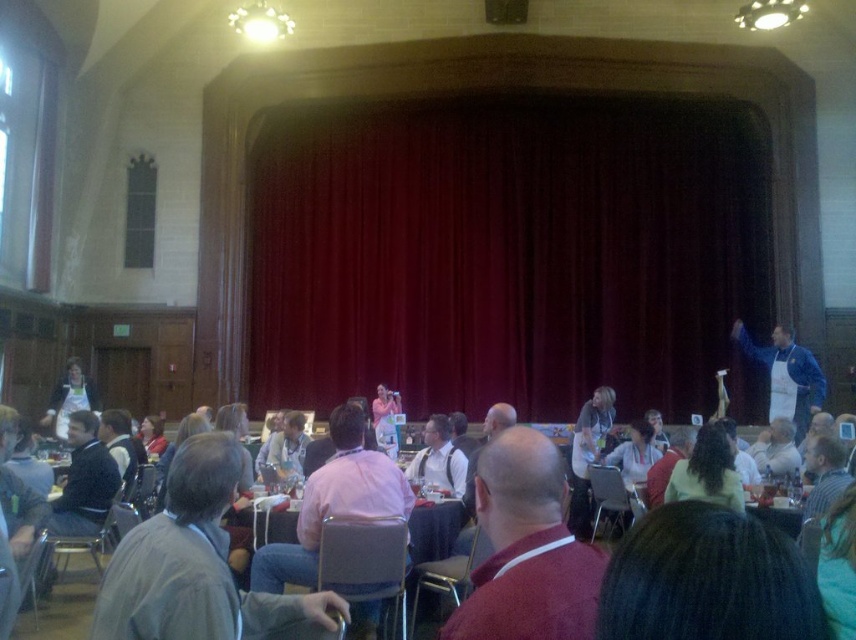
Does red velvet curtain at center have a lesser width compared to curly hair at center?

Incorrect, red velvet curtain at center's width is not less than curly hair at center's.

In the scene shown: Who is taller, red velvet curtain at center or curly hair at center?

With more height is red velvet curtain at center.

Is point (409, 298) behind point (708, 449)?

Yes, it is.

The image size is (856, 640). Find the location of `red velvet curtain at center`. red velvet curtain at center is located at coordinates (504, 253).

Is curly hair at center positioned in front of matte pink shirt at center?

That is True.

I want to click on curly hair at center, so click(x=706, y=472).

Which is in front, point (670, 474) or point (276, 476)?

Point (670, 474) is in front.

Where is `curly hair at center`? This screenshot has height=640, width=856. curly hair at center is located at coordinates (706, 472).

Is red velvet curtain at center above matte white shirt at center?

Yes.

Which is in front, point (293, 243) or point (415, 456)?

Point (415, 456) is more forward.

Between point (738, 138) and point (438, 428), which one is positioned in front?

Point (438, 428) is in front.

Locate an element on the screen. This screenshot has height=640, width=856. red velvet curtain at center is located at coordinates (504, 253).